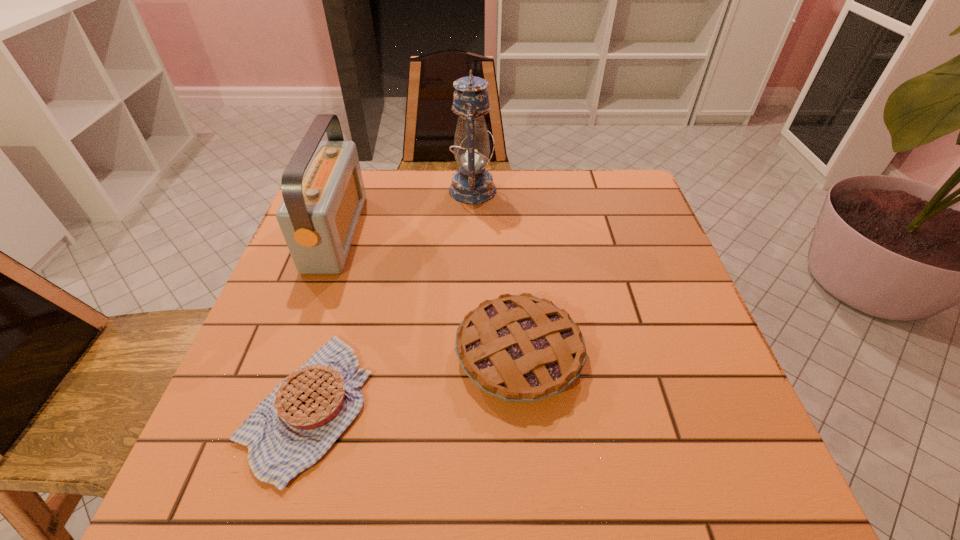
Locate an element on the screen. lantern situated at the far edge is located at coordinates (472, 184).

I want to click on radio receiver that is at the far edge, so click(322, 186).

Locate an element on the screen. The image size is (960, 540). object that is at the near edge is located at coordinates (290, 430).

This screenshot has height=540, width=960. I want to click on radio receiver that is at the left edge, so click(322, 186).

Find the location of `pie positioned at the left edge`. pie positioned at the left edge is located at coordinates (290, 430).

Locate an element on the screen. The width and height of the screenshot is (960, 540). object that is at the far left corner is located at coordinates pyautogui.click(x=322, y=186).

Find the location of a particular element. This screenshot has width=960, height=540. object present at the near left corner is located at coordinates (290, 430).

The height and width of the screenshot is (540, 960). Identify the location of vacant space at the far edge of the desktop. (447, 215).

Where is `vacant space at the near edge`? vacant space at the near edge is located at coordinates (411, 444).

The image size is (960, 540). In the image, there is a desktop. Find the location of `free region at the left edge`. free region at the left edge is located at coordinates (298, 274).